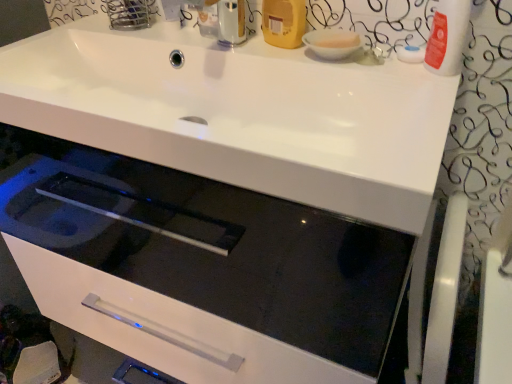
This screenshot has width=512, height=384. Find the location of `free space in front of white ceramic bowl at upper right`. free space in front of white ceramic bowl at upper right is located at coordinates (373, 76).